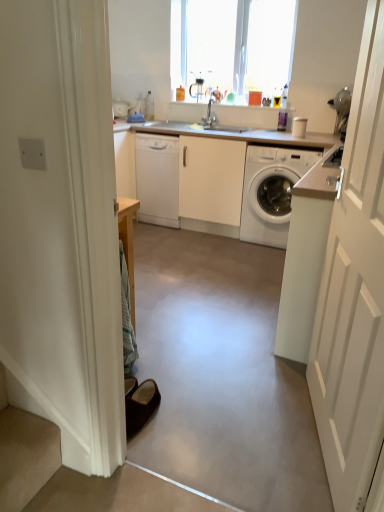
The width and height of the screenshot is (384, 512). Identify the location of transparent glass window at upper center. (231, 44).

Identify the location of white glossy countertop at center. (192, 174).

This screenshot has width=384, height=512. Describe the element at coordinates (209, 116) in the screenshot. I see `satin nickel faucet at center` at that location.

Locate an element on the screen. brown suede slippers at lower left is located at coordinates (140, 403).

Where is `white glossy washing machine at right`? This screenshot has width=384, height=512. white glossy washing machine at right is located at coordinates (271, 192).

At what (x,y) coordinates should I click in order to perform the action: click on transparent glass window at upper center. Please return your answer as a coordinate pair (x, y). The width and height of the screenshot is (384, 512). Looking at the image, I should click on (231, 44).

Is white glossy dishwasher at center inside white glossy washing machine at right?

Actually, white glossy dishwasher at center is outside white glossy washing machine at right.

Considering the positions of point (256, 193) and point (150, 149), is point (256, 193) closer or farther from the camera than point (150, 149)?

Clearly, point (256, 193) is closer to the camera than point (150, 149).

Is white glossy washing machine at right oriented towards white glossy dishwasher at center?

No, white glossy washing machine at right does not turn towards white glossy dishwasher at center.

Considering the relative sizes of white glossy washing machine at right and white glossy dishwasher at center in the image provided, is white glossy washing machine at right smaller than white glossy dishwasher at center?

No, white glossy washing machine at right is not smaller than white glossy dishwasher at center.

Can you confirm if brown suede slippers at lower left is positioned to the left of transparent glass window at upper center?

Correct, you'll find brown suede slippers at lower left to the left of transparent glass window at upper center.

Does point (142, 387) come in front of point (252, 55)?

That is True.

Identify the location of footwear to the left of transparent glass window at upper center. The width and height of the screenshot is (384, 512). (140, 403).

Between brown suede slippers at lower left and transparent glass window at upper center, which one has smaller width?

transparent glass window at upper center.

Which is less distant, (141,416) or (344,222)?

Point (141,416) is positioned farther from the camera compared to point (344,222).

Which object is positioned more to the left, brown suede slippers at lower left or white wooden door at right?

Positioned to the left is brown suede slippers at lower left.

Considering the relative sizes of brown suede slippers at lower left and white wooden door at right in the image provided, is brown suede slippers at lower left thinner than white wooden door at right?

No, brown suede slippers at lower left is not thinner than white wooden door at right.

Is point (282, 223) closer to camera compared to point (360, 279)?

No.

Is white glossy washing machine at right spatially inside white wooden door at right, or outside of it?

white glossy washing machine at right is spatially situated outside white wooden door at right.

Is white glossy washing machine at right at the right side of white wooden door at right?

Indeed, white glossy washing machine at right is positioned on the right side of white wooden door at right.

From the image's perspective, is white glossy washing machine at right on white wooden door at right?

Indeed, from the image's perspective, white glossy washing machine at right is shown above white wooden door at right.

From a real-world perspective, is transparent glass window at upper center above or below white wooden door at right?

Clearly, from a real-world perspective, transparent glass window at upper center is above white wooden door at right.

The height and width of the screenshot is (512, 384). I want to click on door located below the transparent glass window at upper center (from the image's perspective), so click(x=354, y=292).

Consider the image. Measure the distance from transparent glass window at upper center to white wooden door at right.

2.89 meters.

From the image's perspective, which one is positioned lower, transparent glass window at upper center or white wooden door at right?

white wooden door at right is shown below in the image.

Would you say satin nickel faucet at center is inside or outside transparent glass window at upper center?

satin nickel faucet at center cannot be found inside transparent glass window at upper center.

Is there a large distance between satin nickel faucet at center and transparent glass window at upper center?

No, there isn't a large distance between satin nickel faucet at center and transparent glass window at upper center.

Is satin nickel faucet at center taller than transparent glass window at upper center?

No, satin nickel faucet at center is not taller than transparent glass window at upper center.

From a real-world perspective, is smooth concrete floor at center positioned over transparent glass window at upper center based on gravity?

No.

Which is more to the left, smooth concrete floor at center or transparent glass window at upper center?

smooth concrete floor at center is more to the left.

Considering the sizes of objects smooth concrete floor at center and transparent glass window at upper center in the image provided, who is wider, smooth concrete floor at center or transparent glass window at upper center?

smooth concrete floor at center is wider.

Find the location of a particular element. The width and height of the screenshot is (384, 512). washing machine below the white glossy dishwasher at center (from the image's perspective) is located at coordinates (271, 192).

Find the location of a particular element. This screenshot has height=512, width=384. footwear that is in front of the transparent glass window at upper center is located at coordinates (140, 403).

Looking at the image, which one is located further to satin nickel faucet at center, white glossy dishwasher at center or brown suede slippers at lower left?

Based on the image, brown suede slippers at lower left appears to be further to satin nickel faucet at center.

Considering their positions, is white glossy washing machine at right positioned closer to white glossy dishwasher at center than white glossy countertop at center?

Based on the image, white glossy countertop at center appears to be nearer to white glossy dishwasher at center.

When comparing their distances from transparent glass window at upper center, does brown suede slippers at lower left or white glossy washing machine at right seem closer?

white glossy washing machine at right is closer to transparent glass window at upper center.

When comparing their distances from satin nickel faucet at center, does white glossy washing machine at right or brown suede slippers at lower left seem further?

brown suede slippers at lower left lies further to satin nickel faucet at center than the other object.

Considering their positions, is white glossy countertop at center positioned further to white glossy dishwasher at center than white glossy washing machine at right?

white glossy washing machine at right.

In the scene shown: When comparing their distances from white glossy dishwasher at center, does white glossy washing machine at right or satin nickel faucet at center seem further?

Based on the image, white glossy washing machine at right appears to be further to white glossy dishwasher at center.

Based on the photo, when comparing their distances from smooth concrete floor at center, does white glossy countertop at center or white glossy washing machine at right seem further?

white glossy countertop at center is positioned further to the anchor smooth concrete floor at center.

When comparing their distances from transparent glass window at upper center, does brown suede slippers at lower left or satin nickel faucet at center seem further?

brown suede slippers at lower left is positioned further to the anchor transparent glass window at upper center.

At what (x,y) coordinates should I click in order to perform the action: click on counter top that lies between transparent glass window at upper center and white glossy washing machine at right from top to bottom. Please return your answer as a coordinate pair (x, y). Looking at the image, I should click on (192, 174).

In order to click on counter top located between brown suede slippers at lower left and white glossy washing machine at right in the depth direction in this screenshot , I will do `click(192, 174)`.

You are a GUI agent. You are given a task and a screenshot of the screen. Output one action in this format:
    pyautogui.click(x=<x>, y=<y>)
    Task: Click on the footwear between white wooden door at right and white glossy washing machine at right along the z-axis
    Image resolution: width=384 pixels, height=512 pixels.
    Given the screenshot: What is the action you would take?
    pyautogui.click(x=140, y=403)

Locate an element on the screen. This screenshot has width=384, height=512. concrete between white wooden door at right and transparent glass window at upper center along the z-axis is located at coordinates (222, 374).